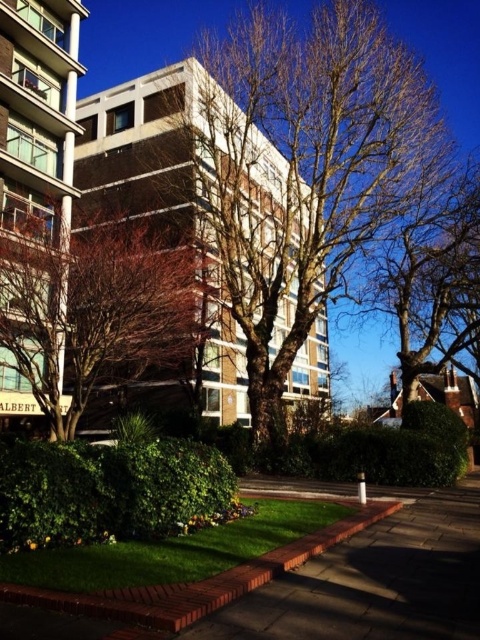
You are a bird looking for a place to perch. You see two sets of bare branches at center and bare branches at upper right. Which one is positioned to the left side from your perspective?

The bare branches at center are positioned to the left of the bare branches at upper right, so the bare branches at center are on the left side.

You are a delivery person approaching the modern residential building. You need to park your delivery van on the paved stone pavement at center. However, there is a tree with bare branches at upper right nearby. Based on their positions, can you tell if the van will be in the shade cast by the tree?

The paved stone pavement at center is to the left of bare branches at upper right. Since the tree with bare branches at upper right is positioned to the right of the pavement, the shade from the tree would likely fall to the left side of the tree. Therefore, the van parked on the paved stone pavement at center might be in the shade depending on the sun angle, but the description does not provide information about the sun position or time of day.

You are standing at the entrance of the residential building and want to walk to the paved stone pavement at center. According to the coordinates provided, can you directly walk there without crossing any obstacles?

The paved stone pavement at center is located at coordinates point (374, 580), so yes, you can directly walk there without crossing any obstacles as it is the central paved area.